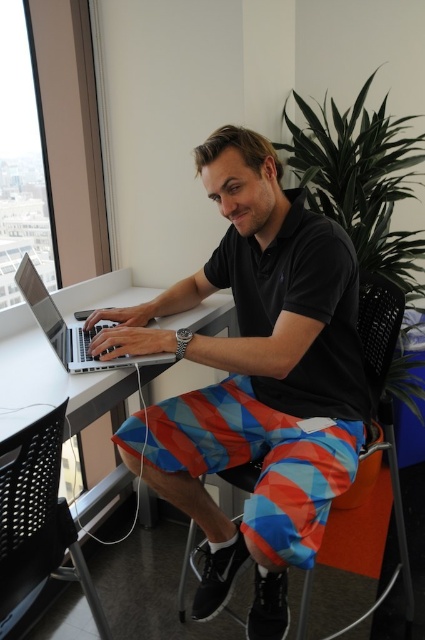
Between black mesh chair at lower left and silver metallic laptop at center, which one is positioned lower?

black mesh chair at lower left is below.

Is point (62, 419) in front of point (87, 349)?

Yes, point (62, 419) is in front of point (87, 349).

Between point (42, 429) and point (64, 353), which one is positioned in front?

Point (42, 429)

Locate an element on the screen. Image resolution: width=425 pixels, height=640 pixels. black mesh chair at lower left is located at coordinates (37, 516).

Between point (79, 512) and point (65, 340), which one is positioned behind?

Positioned behind is point (79, 512).

Consider the image. Does white plastic table at left lie in front of silver metallic laptop at center?

Yes, it is in front of silver metallic laptop at center.

This screenshot has width=425, height=640. What do you see at coordinates (50, 380) in the screenshot?
I see `white plastic table at left` at bounding box center [50, 380].

Where is `white plastic table at left`? The width and height of the screenshot is (425, 640). white plastic table at left is located at coordinates (50, 380).

Who is more distant from viewer, (363, 310) or (81, 371)?

The point (363, 310) is behind.

Can you confirm if orange fabric chair at center is taller than silver metallic laptop at center?

Yes, orange fabric chair at center is taller than silver metallic laptop at center.

I want to click on orange fabric chair at center, so [379, 324].